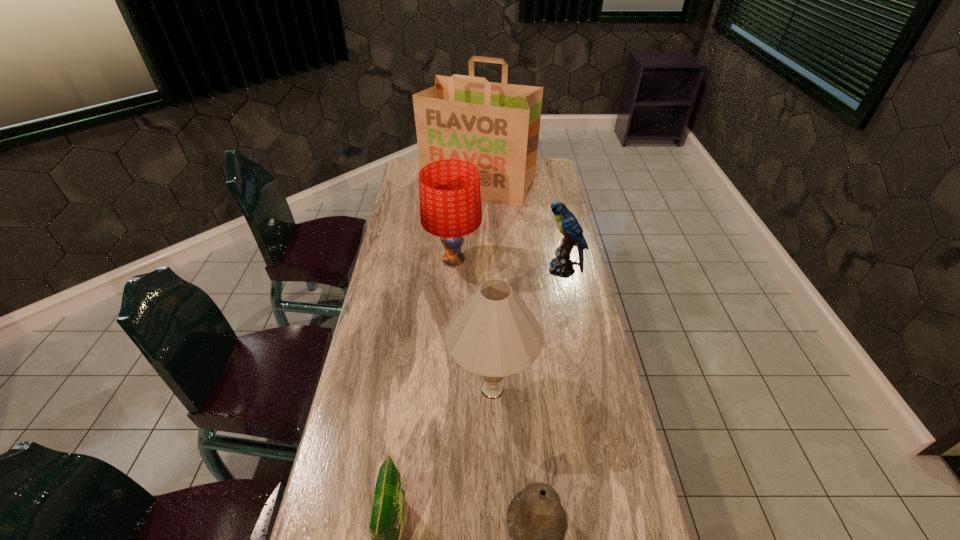
The image size is (960, 540). Identify the location of vacant region located 0.290m on the face of the parrot. (x=465, y=270).

Locate an element on the screen. object that is at the far edge is located at coordinates pos(495,126).

Find the location of a particular element. The image size is (960, 540). grocery bag that is at the left edge is located at coordinates (495, 126).

The image size is (960, 540). What are the coordinates of `lampshade that is at the left edge` in the screenshot? It's located at (450, 198).

Find the location of a particular element. grocery bag located in the right edge section of the desktop is located at coordinates (495, 126).

Where is `parrot at the right edge`? The image size is (960, 540). parrot at the right edge is located at coordinates (562, 266).

Locate an element on the screen. The image size is (960, 540). object positioned at the far left corner is located at coordinates (495, 126).

Where is `object at the far right corner`? The width and height of the screenshot is (960, 540). object at the far right corner is located at coordinates (495, 126).

I want to click on free space at the left edge of the desktop, so click(409, 228).

Locate an element on the screen. The height and width of the screenshot is (540, 960). vacant space at the right edge of the desktop is located at coordinates (538, 246).